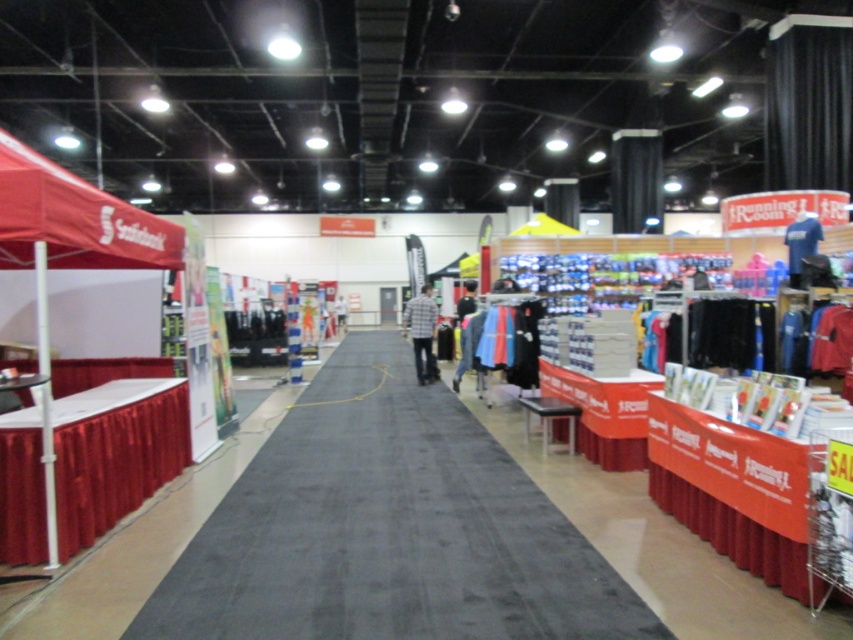
You are standing in the center of the exhibition hall and want to locate the red fabric canopy at upper left. According to the coordinates provided, in which direction should you move to face it?

The red fabric canopy at upper left is located at coordinates point (74, 220). Since you are at the center, you should move towards the upper left direction to face it.